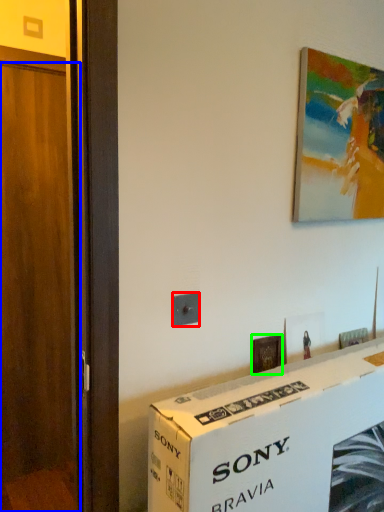
Question: Considering the real-world distances, which object is closest to electric outlet (highlighted by a red box)? door (highlighted by a blue box) or picture frame (highlighted by a green box).

Choices:
 (A) door
 (B) picture frame

Answer: (B)